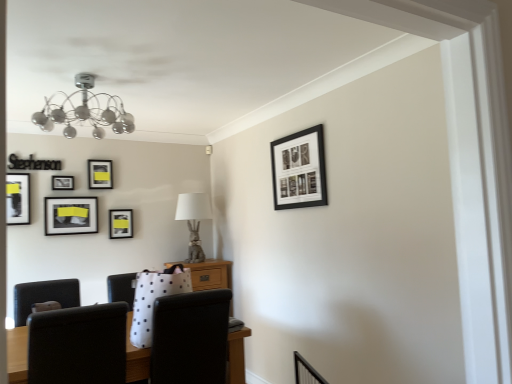
Question: From the image's perspective, does matte black picture frame at left, which is the third picture frame from left to right, appear higher than matte black picture frame at upper left, the 2th picture frame in the left-to-right sequence?

Choices:
 (A) yes
 (B) no

Answer: (B)

Question: Is matte black picture frame at left, positioned as the third picture frame in front-to-back order, at the right side of matte black picture frame at upper left, which is the third picture frame from back to front?

Choices:
 (A) yes
 (B) no

Answer: (A)

Question: Is matte black picture frame at left, positioned as the third picture frame in front-to-back order, completely or partially outside of matte black picture frame at upper left, which ranks as the fourth picture frame in front-to-back order?

Choices:
 (A) no
 (B) yes

Answer: (B)

Question: Are matte black picture frame at left, placed as the 4th picture frame when sorted from back to front, and matte black picture frame at upper left, which ranks as the fourth picture frame in front-to-back order, beside each other?

Choices:
 (A) yes
 (B) no

Answer: (B)

Question: Considering the relative sizes of matte black picture frame at left, positioned as the 4th picture frame in right-to-left order, and matte black picture frame at upper left, the 2th picture frame in the left-to-right sequence, in the image provided, is matte black picture frame at left, positioned as the 4th picture frame in right-to-left order, taller than matte black picture frame at upper left, the 2th picture frame in the left-to-right sequence,?

Choices:
 (A) no
 (B) yes

Answer: (B)

Question: Does matte black picture frame at left, placed as the 4th picture frame when sorted from back to front, have a smaller size compared to matte black picture frame at upper left, which ranks as the fourth picture frame in front-to-back order?

Choices:
 (A) no
 (B) yes

Answer: (A)

Question: Does gray stone rabbit at center appear on the left side of matte black picture frame at left, placed as the 4th picture frame when sorted from back to front?

Choices:
 (A) no
 (B) yes

Answer: (A)

Question: Is gray stone rabbit at center thinner than matte black picture frame at left, positioned as the third picture frame in front-to-back order?

Choices:
 (A) no
 (B) yes

Answer: (A)

Question: Could you tell me if gray stone rabbit at center is facing matte black picture frame at left, placed as the 4th picture frame when sorted from back to front?

Choices:
 (A) yes
 (B) no

Answer: (B)

Question: Can we say gray stone rabbit at center lies outside matte black picture frame at left, positioned as the 4th picture frame in right-to-left order?

Choices:
 (A) yes
 (B) no

Answer: (A)

Question: From the image's perspective, is gray stone rabbit at center on top of matte black picture frame at left, which is the third picture frame from left to right?

Choices:
 (A) no
 (B) yes

Answer: (A)

Question: Does gray stone rabbit at center have a lesser height compared to matte black picture frame at left, positioned as the 4th picture frame in right-to-left order?

Choices:
 (A) yes
 (B) no

Answer: (B)

Question: Does matte black picture frame at left, which is the third picture frame from left to right, have a greater height compared to black matte picture frame at upper right, which is counted as the 6th picture frame, starting from the left?

Choices:
 (A) no
 (B) yes

Answer: (A)